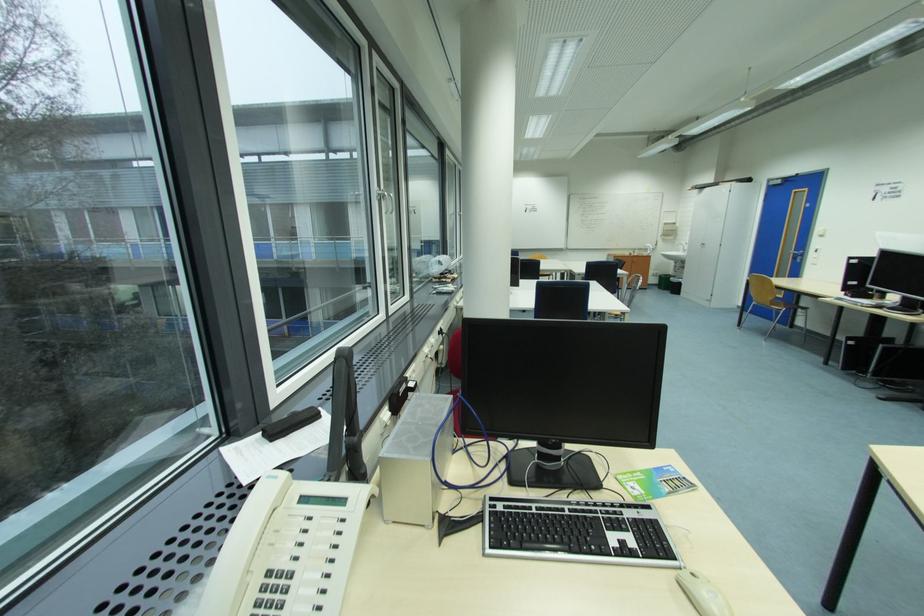
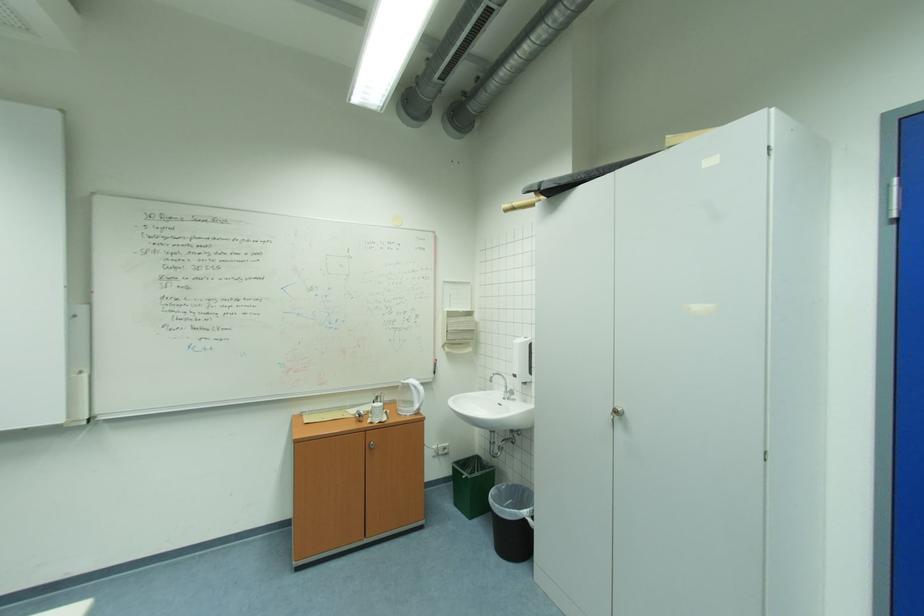
Find the pixel in the second image that matches the point at 652,254 in the first image.

(415, 411)